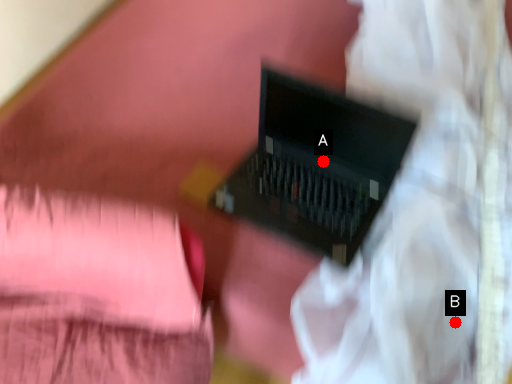
Question: Two points are circled on the image, labeled by A and B beside each circle. Among these points, which one is nearest to the camera?

Choices:
 (A) A is closer
 (B) B is closer

Answer: (B)